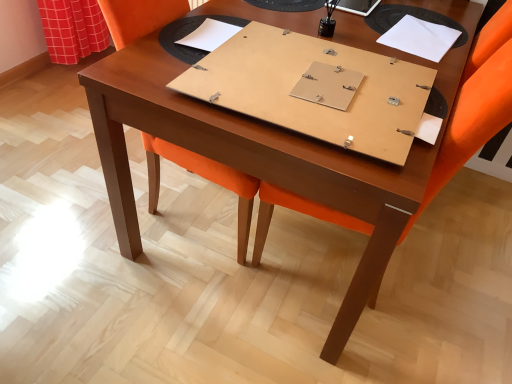
Describe the element at coordinates (475, 105) in the screenshot. I see `orange fabric chair at center` at that location.

Measure the distance between point (212, 24) and camera.

Point (212, 24) and camera are 1.40 meters apart from each other.

Describe the element at coordinates (209, 35) in the screenshot. The width and height of the screenshot is (512, 384). I see `white cardboard notebook at upper center, marked as the first notebook in a left-to-right arrangement` at that location.

The width and height of the screenshot is (512, 384). What do you see at coordinates (420, 38) in the screenshot? I see `white paper at upper right, acting as the 3th notebook starting from the left` at bounding box center [420, 38].

You are a GUI agent. You are given a task and a screenshot of the screen. Output one action in this format:
    pyautogui.click(x=<x>, y=<y>)
    Task: Click on the orange fabric swivel chair at center
    The width and height of the screenshot is (512, 384).
    Given the screenshot: What is the action you would take?
    pyautogui.click(x=205, y=178)

Locate an element on the screen. Image resolution: width=512 pixels, height=384 pixels. matte wood notebook at center, positioned as the 2th notebook in right-to-left order is located at coordinates (315, 89).

Considering the relative sizes of orange fabric chair at center and matte wood notebook at center, which is the 2th notebook from left to right, in the image provided, is orange fabric chair at center thinner than matte wood notebook at center, which is the 2th notebook from left to right,?

Yes.

In the scene shown: Looking at the image, does orange fabric chair at center seem bigger or smaller compared to matte wood notebook at center, which is the 2th notebook from left to right?

Considering their sizes, orange fabric chair at center takes up more space than matte wood notebook at center, which is the 2th notebook from left to right.

Is orange fabric chair at center in front of or behind matte wood notebook at center, which is the 2th notebook from left to right, in the image?

Clearly, orange fabric chair at center is in front of matte wood notebook at center, which is the 2th notebook from left to right.

Is white paper at upper right, acting as the 3th notebook starting from the left, to the left of white cardboard notebook at upper center, placed as the 3th notebook when sorted from right to left, from the viewer's perspective?

No.

From a real-world perspective, who is located lower, white paper at upper right, acting as the 3th notebook starting from the left, or white cardboard notebook at upper center, marked as the first notebook in a left-to-right arrangement?

In real-world perspective, white paper at upper right, acting as the 3th notebook starting from the left, is lower.

Are white paper at upper right, acting as the 3th notebook starting from the left, and white cardboard notebook at upper center, placed as the 3th notebook when sorted from right to left, located far from each other?

Actually, white paper at upper right, acting as the 3th notebook starting from the left, and white cardboard notebook at upper center, placed as the 3th notebook when sorted from right to left, are a little close together.

Is the surface of matte wood notebook at center, positioned as the 2th notebook in right-to-left order, in direct contact with orange fabric chair at center?

No, matte wood notebook at center, positioned as the 2th notebook in right-to-left order, is not with orange fabric chair at center.

In the scene shown: Choose the correct answer: Is matte wood notebook at center, positioned as the 2th notebook in right-to-left order, inside orange fabric chair at center or outside it?

matte wood notebook at center, positioned as the 2th notebook in right-to-left order, is spatially positioned inside orange fabric chair at center.

From the image's perspective, would you say matte wood notebook at center, which is the 2th notebook from left to right, is positioned over orange fabric chair at center?

Indeed, from the image's perspective, matte wood notebook at center, which is the 2th notebook from left to right, is shown above orange fabric chair at center.

Consider the image. From a real-world perspective, is matte wood notebook at center, positioned as the 2th notebook in right-to-left order, on orange fabric chair at center?

Yes, from a real-world perspective, matte wood notebook at center, positioned as the 2th notebook in right-to-left order, is above orange fabric chair at center.

From the image's perspective, is orange fabric chair at center located beneath orange fabric swivel chair at center?

Correct, orange fabric chair at center appears lower than orange fabric swivel chair at center in the image.

Can you confirm if orange fabric chair at center is positioned to the right of orange fabric swivel chair at center?

Correct, you'll find orange fabric chair at center to the right of orange fabric swivel chair at center.

You are a GUI agent. You are given a task and a screenshot of the screen. Output one action in this format:
    pyautogui.click(x=<x>, y=<y>)
    Task: Click on the swivel chair above the orange fabric chair at center (from the image's perspective)
    Image resolution: width=512 pixels, height=384 pixels.
    Given the screenshot: What is the action you would take?
    pyautogui.click(x=205, y=178)

What's the angular difference between white paper at upper right, acting as the 3th notebook starting from the left, and orange fabric swivel chair at center's facing directions?

white paper at upper right, acting as the 3th notebook starting from the left, and orange fabric swivel chair at center are facing 172 degrees away from each other.

Is white paper at upper right, which is the 1th notebook from right to left, looking in the opposite direction of orange fabric swivel chair at center?

No.

Can you confirm if white paper at upper right, which is the 1th notebook from right to left, is smaller than orange fabric swivel chair at center?

Indeed, white paper at upper right, which is the 1th notebook from right to left, has a smaller size compared to orange fabric swivel chair at center.

Which is closer, (236, 58) or (166, 21)?

Point (236, 58).

From a real-world perspective, who is located higher, matte wood notebook at center, positioned as the 2th notebook in right-to-left order, or orange fabric swivel chair at center?

matte wood notebook at center, positioned as the 2th notebook in right-to-left order, from a real-world perspective.

Can you confirm if matte wood notebook at center, which is the 2th notebook from left to right, is wider than orange fabric swivel chair at center?

Yes, matte wood notebook at center, which is the 2th notebook from left to right, is wider than orange fabric swivel chair at center.

Is matte wood notebook at center, positioned as the 2th notebook in right-to-left order, inside the boundaries of orange fabric swivel chair at center, or outside?

matte wood notebook at center, positioned as the 2th notebook in right-to-left order, is not enclosed by orange fabric swivel chair at center.

Based on their sizes in the image, would you say orange fabric swivel chair at center is bigger or smaller than white cardboard notebook at upper center, marked as the first notebook in a left-to-right arrangement?

Considering their sizes, orange fabric swivel chair at center takes up more space than white cardboard notebook at upper center, marked as the first notebook in a left-to-right arrangement.

From the image's perspective, relative to white cardboard notebook at upper center, placed as the 3th notebook when sorted from right to left, is orange fabric swivel chair at center above or below?

Clearly, from the image's perspective, orange fabric swivel chair at center is below white cardboard notebook at upper center, placed as the 3th notebook when sorted from right to left.

Considering the relative positions of orange fabric swivel chair at center and white cardboard notebook at upper center, marked as the first notebook in a left-to-right arrangement, in the image provided, is orange fabric swivel chair at center to the left or to the right of white cardboard notebook at upper center, marked as the first notebook in a left-to-right arrangement,?

orange fabric swivel chair at center is positioned on white cardboard notebook at upper center, marked as the first notebook in a left-to-right arrangement,'s left side.

From a real-world perspective, is orange fabric swivel chair at center located higher than white cardboard notebook at upper center, placed as the 3th notebook when sorted from right to left?

No, from a real-world perspective, orange fabric swivel chair at center is not over white cardboard notebook at upper center, placed as the 3th notebook when sorted from right to left

In the image, there is a matte wood notebook at center, positioned as the 2th notebook in right-to-left order. Find the location of `chair below it (from a real-world perspective)`. chair below it (from a real-world perspective) is located at coordinates (475, 105).

Starting from the white cardboard notebook at upper center, marked as the first notebook in a left-to-right arrangement, which notebook is the 2nd one to the right? Please provide its 2D coordinates.

[(420, 38)]

Which object lies further to the anchor point white cardboard notebook at upper center, marked as the first notebook in a left-to-right arrangement, white paper at upper right, acting as the 3th notebook starting from the left, or orange fabric chair at center?

orange fabric chair at center lies further to white cardboard notebook at upper center, marked as the first notebook in a left-to-right arrangement, than the other object.

From the image, which object appears to be nearer to orange fabric chair at center, matte wood notebook at center, positioned as the 2th notebook in right-to-left order, or white paper at upper right, which is the 1th notebook from right to left?

Based on the image, matte wood notebook at center, positioned as the 2th notebook in right-to-left order, appears to be nearer to orange fabric chair at center.

Based on their spatial positions, is white cardboard notebook at upper center, placed as the 3th notebook when sorted from right to left, or orange fabric chair at center closer to orange fabric swivel chair at center?

Among the two, orange fabric chair at center is located nearer to orange fabric swivel chair at center.

From the image, which object appears to be nearer to orange fabric chair at center, white paper at upper right, which is the 1th notebook from right to left, or white cardboard notebook at upper center, placed as the 3th notebook when sorted from right to left?

white paper at upper right, which is the 1th notebook from right to left.

Estimate the real-world distances between objects in this image. Which object is closer to matte wood notebook at center, which is the 2th notebook from left to right, white cardboard notebook at upper center, marked as the first notebook in a left-to-right arrangement, or white paper at upper right, which is the 1th notebook from right to left?

white cardboard notebook at upper center, marked as the first notebook in a left-to-right arrangement.

Looking at the image, which one is located closer to matte wood notebook at center, which is the 2th notebook from left to right, orange fabric chair at center or white paper at upper right, which is the 1th notebook from right to left?

orange fabric chair at center lies closer to matte wood notebook at center, which is the 2th notebook from left to right, than the other object.

Estimate the real-world distances between objects in this image. Which object is closer to orange fabric chair at center, matte wood notebook at center, positioned as the 2th notebook in right-to-left order, or orange fabric swivel chair at center?

matte wood notebook at center, positioned as the 2th notebook in right-to-left order, is positioned closer to the anchor orange fabric chair at center.

From the image, which object appears to be farther from white paper at upper right, which is the 1th notebook from right to left, white cardboard notebook at upper center, placed as the 3th notebook when sorted from right to left, or matte wood notebook at center, positioned as the 2th notebook in right-to-left order?

white cardboard notebook at upper center, placed as the 3th notebook when sorted from right to left.

Where is `notebook between white cardboard notebook at upper center, marked as the first notebook in a left-to-right arrangement, and white paper at upper right, acting as the 3th notebook starting from the left, in the horizontal direction`? notebook between white cardboard notebook at upper center, marked as the first notebook in a left-to-right arrangement, and white paper at upper right, acting as the 3th notebook starting from the left, in the horizontal direction is located at coordinates (315, 89).

Identify the location of notebook between white cardboard notebook at upper center, marked as the first notebook in a left-to-right arrangement, and orange fabric chair at center from left to right. (315, 89).

Find the location of a particular element. This screenshot has width=512, height=384. chair located between orange fabric swivel chair at center and white paper at upper right, acting as the 3th notebook starting from the left, in the left-right direction is located at coordinates (475, 105).

Where is `chair between white cardboard notebook at upper center, placed as the 3th notebook when sorted from right to left, and white paper at upper right, which is the 1th notebook from right to left, in the horizontal direction`? The width and height of the screenshot is (512, 384). chair between white cardboard notebook at upper center, placed as the 3th notebook when sorted from right to left, and white paper at upper right, which is the 1th notebook from right to left, in the horizontal direction is located at coordinates (475, 105).